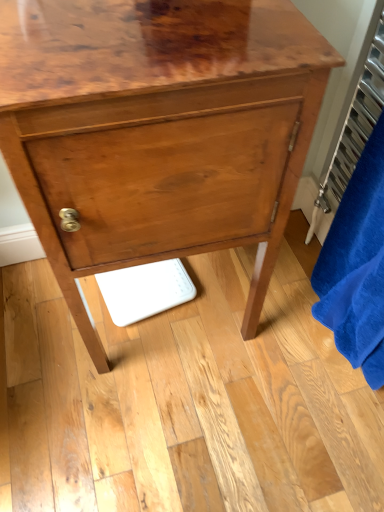
Question: In terms of width, does blue plush bath towel at right look wider or thinner when compared to metallic silver radiator at right?

Choices:
 (A) wide
 (B) thin

Answer: (A)

Question: Relative to metallic silver radiator at right, is blue plush bath towel at right in front or behind?

Choices:
 (A) behind
 (B) front

Answer: (B)

Question: Which object is the closest to the glossy wood chest of drawers at center?

Choices:
 (A) metallic silver radiator at right
 (B) blue plush bath towel at right

Answer: (B)

Question: Which is nearer to the metallic silver radiator at right?

Choices:
 (A) glossy wood chest of drawers at center
 (B) blue plush bath towel at right

Answer: (B)